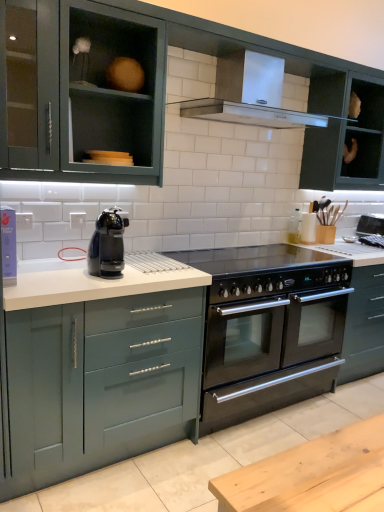
Question: Is black glass cooktop at center facing towards satin silver range hood at upper center?

Choices:
 (A) yes
 (B) no

Answer: (B)

Question: Does black glass cooktop at center come in front of satin silver range hood at upper center?

Choices:
 (A) yes
 (B) no

Answer: (B)

Question: Is black glass cooktop at center far away from satin silver range hood at upper center?

Choices:
 (A) no
 (B) yes

Answer: (A)

Question: From a real-world perspective, is black glass cooktop at center on satin silver range hood at upper center?

Choices:
 (A) yes
 (B) no

Answer: (B)

Question: Is black glass cooktop at center at the right side of satin silver range hood at upper center?

Choices:
 (A) yes
 (B) no

Answer: (B)

Question: Relative to matte teal cabinet at left, the fourth cabinetry from the top, is black stainless steel oven at center in front or behind?

Choices:
 (A) behind
 (B) front

Answer: (A)

Question: Is point (331, 309) positioned closer to the camera than point (142, 423)?

Choices:
 (A) farther
 (B) closer

Answer: (A)

Question: From the image's perspective, is black stainless steel oven at center located above or below matte teal cabinet at left, the fourth cabinetry from the top?

Choices:
 (A) below
 (B) above

Answer: (A)

Question: From a real-world perspective, is black stainless steel oven at center physically located above or below matte teal cabinet at left, which appears as the first cabinetry when ordered from the bottom?

Choices:
 (A) below
 (B) above

Answer: (A)

Question: Is matte green cabinet at upper left, the second cabinetry in the top-to-bottom sequence, spatially inside black stainless steel oven at center, or outside of it?

Choices:
 (A) inside
 (B) outside

Answer: (B)

Question: Based on their positions, is matte green cabinet at upper left, the second cabinetry in the top-to-bottom sequence, located to the left or right of black stainless steel oven at center?

Choices:
 (A) left
 (B) right

Answer: (A)

Question: Considering the positions of matte green cabinet at upper left, positioned as the third cabinetry in bottom-to-top order, and black stainless steel oven at center in the image, is matte green cabinet at upper left, positioned as the third cabinetry in bottom-to-top order, wider or thinner than black stainless steel oven at center?

Choices:
 (A) wide
 (B) thin

Answer: (A)

Question: Is matte green cabinet at upper left, the second cabinetry in the top-to-bottom sequence, in front of or behind black stainless steel oven at center in the image?

Choices:
 (A) front
 (B) behind

Answer: (A)

Question: Would you say black plastic coffee machine at center is inside or outside satin silver range hood at upper center?

Choices:
 (A) inside
 (B) outside

Answer: (B)

Question: Considering the positions of black plastic coffee machine at center and satin silver range hood at upper center in the image, is black plastic coffee machine at center bigger or smaller than satin silver range hood at upper center?

Choices:
 (A) big
 (B) small

Answer: (B)